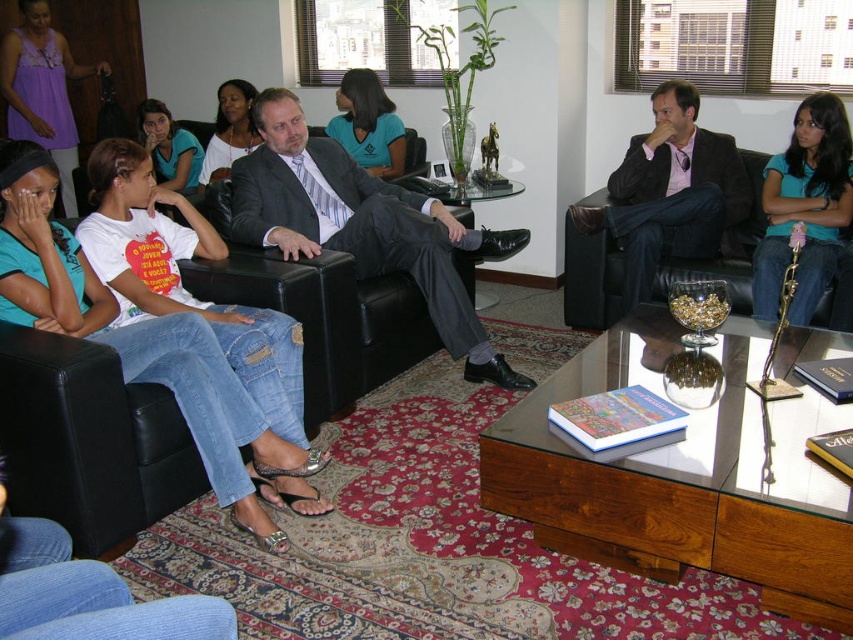
Between blue jeans at left and matte blue shirt at center, which one is positioned lower?

blue jeans at left is lower down.

Can you confirm if blue jeans at left is positioned above matte blue shirt at center?

Incorrect, blue jeans at left is not positioned above matte blue shirt at center.

Who is more forward, (247, 474) or (199, 144)?

Point (247, 474) is in front.

This screenshot has height=640, width=853. I want to click on blue jeans at left, so click(143, 346).

Is matte black suit at center behind matte black dress at center?

No, it is in front of matte black dress at center.

How far apart are matte black suit at center and matte black dress at center?

matte black suit at center and matte black dress at center are 7.16 feet apart from each other.

Between point (729, 168) and point (253, 97), which one is positioned behind?

Positioned behind is point (253, 97).

You are a GUI agent. You are given a task and a screenshot of the screen. Output one action in this format:
    pyautogui.click(x=<x>, y=<y>)
    Task: Click on the matte black suit at center
    The height and width of the screenshot is (640, 853).
    Given the screenshot: What is the action you would take?
    pyautogui.click(x=672, y=189)

Does black leather couch at center have a greater width compared to purple cotton tank top at upper left?

Yes, black leather couch at center is wider than purple cotton tank top at upper left.

In the scene shown: Does black leather couch at center appear on the right side of purple cotton tank top at upper left?

Correct, you'll find black leather couch at center to the right of purple cotton tank top at upper left.

Is point (752, 154) farther from camera compared to point (22, 93)?

No.

Image resolution: width=853 pixels, height=640 pixels. In order to click on black leather couch at center in this screenshot , I will do `click(590, 266)`.